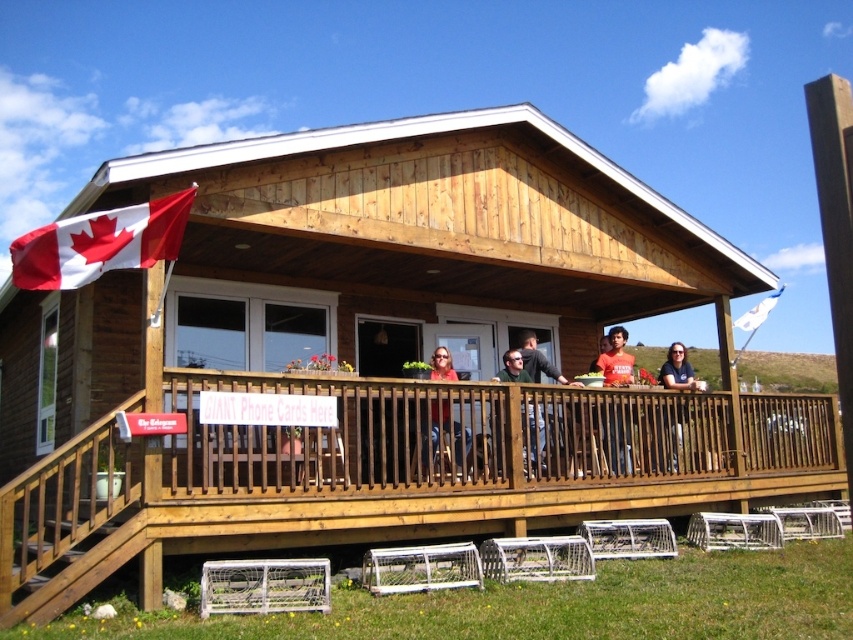
You are standing at the origin point of the coordinate system. You want to walk to the dark blue shirt at center. Which direction should you move? Please answer with a direction like north, south, east, west, or a combination of these.

The dark blue shirt at center is located at coordinate point 0.580 in the x direction and 0.796 in the y direction. Since the origin is at the bottom left corner, moving east would increase the x coordinate and moving north would increase the y coordinate. To reach the dark blue shirt at center, you should move northeast.

You are standing on the brown wooden porch at upper center and want to wave at someone standing near the white fabric flag at upper right. In which direction should you move to face them?

You should move to your right because the brown wooden porch at upper center is to the left of the white fabric flag at upper right, so facing towards the right will allow you to see the flag and the person near it.